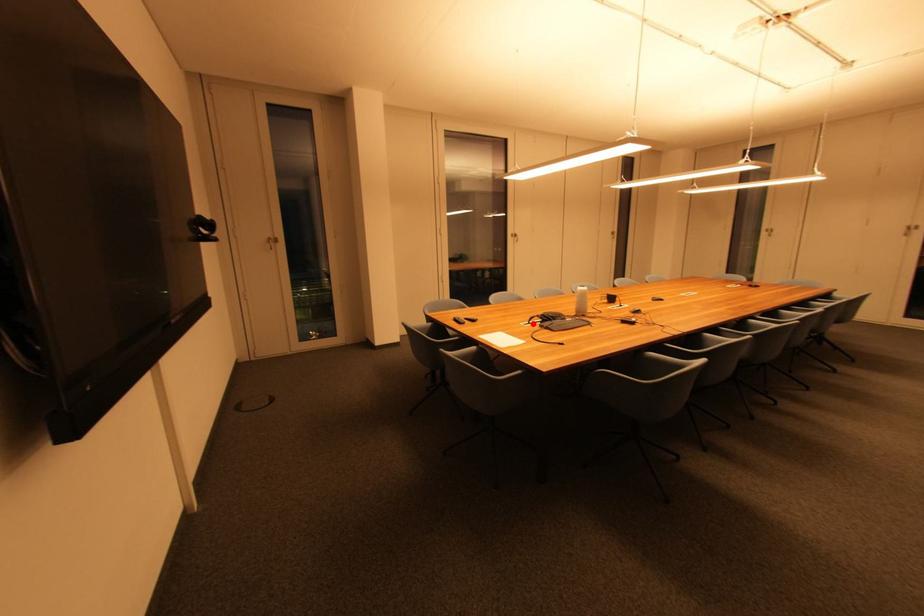
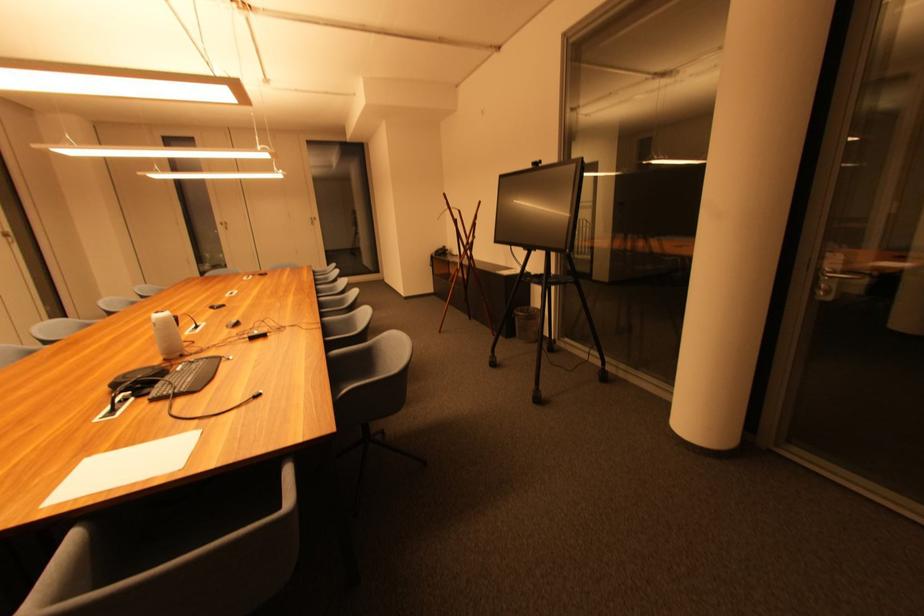
Question: I am providing you with two images of the same scene from different viewpoints. A red point is marked on the first image. Can you still see the location of the red point in image 2?

Choices:
 (A) Yes
 (B) No

Answer: (A)